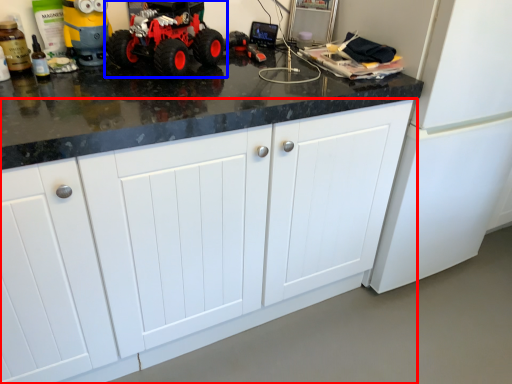
Question: Among these objects, which one is farthest to the camera, cabinetry (highlighted by a red box) or land vehicle (highlighted by a blue box)?

Choices:
 (A) cabinetry
 (B) land vehicle

Answer: (B)